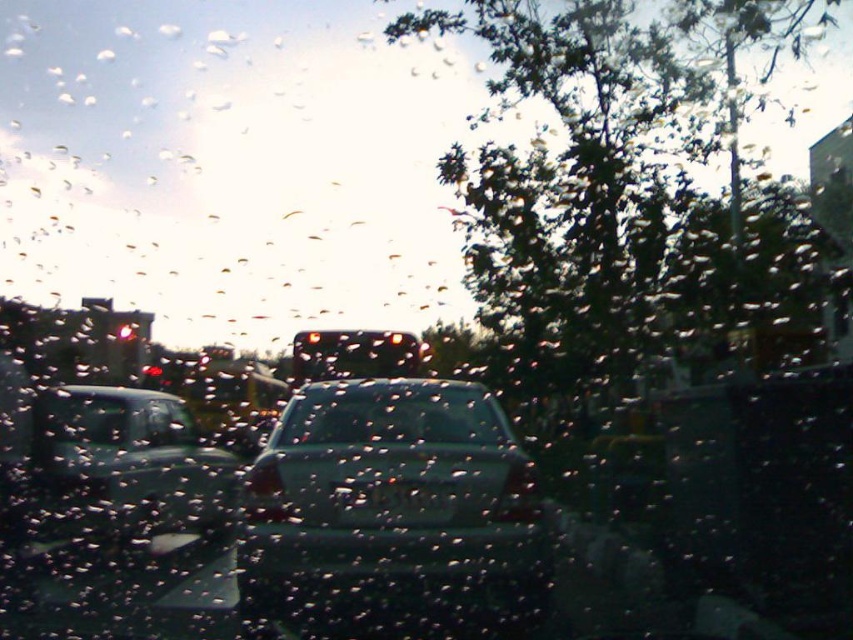
In order to click on white plastic license plate at center in this screenshot , I will do `click(393, 502)`.

Who is lower down, white plastic license plate at center or clear glass car window at lower left?

white plastic license plate at center

Is point (439, 515) farther from viewer compared to point (67, 416)?

No, it is in front of (67, 416).

Where is `white plastic license plate at center`? white plastic license plate at center is located at coordinates (393, 502).

Does point (252, 476) come farther from viewer compared to point (177, 433)?

That is False.

Is satin silver car at center closer to camera compared to satin black sedan at left?

Yes, satin silver car at center is closer to the viewer.

Is point (384, 570) less distant than point (61, 531)?

Yes, it is.

The height and width of the screenshot is (640, 853). I want to click on satin silver car at center, so click(392, 500).

Does satin silver car at center lie in front of clear glass car window at lower left?

That is True.

Is point (384, 417) positioned after point (102, 412)?

No, it is not.

Is point (299, 451) farther from viewer compared to point (109, 413)?

No, (299, 451) is in front of (109, 413).

This screenshot has width=853, height=640. What are the coordinates of `satin silver car at center` in the screenshot? It's located at (392, 500).